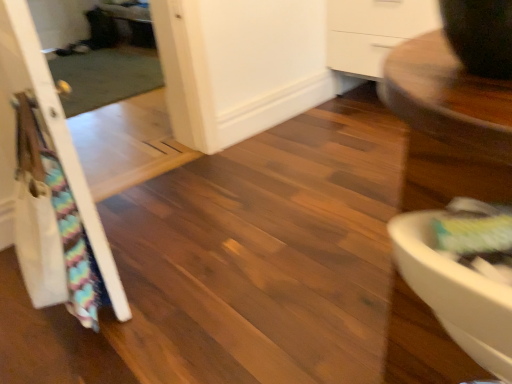
Where is `empty space that is to the right of white wood door at left`? empty space that is to the right of white wood door at left is located at coordinates (227, 263).